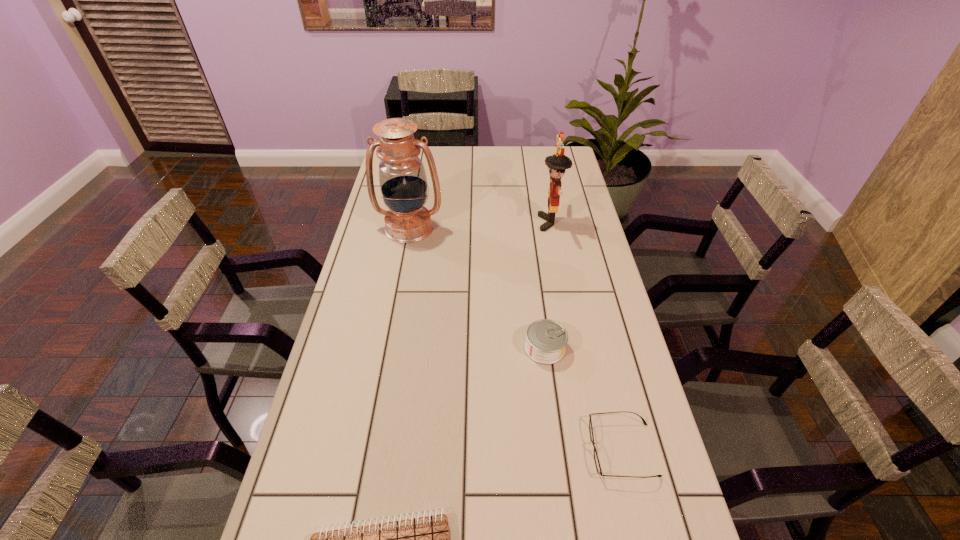
Find the location of a particular element. oil lamp is located at coordinates (403, 182).

Locate an element on the screen. This screenshot has width=960, height=540. nutcracker is located at coordinates (557, 164).

The image size is (960, 540). What are the coordinates of `the third farthest object` in the screenshot? It's located at [x=546, y=339].

This screenshot has width=960, height=540. Identify the location of can. (546, 339).

You are a GUI agent. You are given a task and a screenshot of the screen. Output one action in this format:
    pyautogui.click(x=<x>, y=<y>)
    Task: Click on the spectacles
    This screenshot has height=540, width=960.
    Given the screenshot: What is the action you would take?
    pyautogui.click(x=596, y=459)

Where is `the second shortest object`? the second shortest object is located at coordinates (596, 459).

Identify the location of vacant region located on the right of the oil lamp. (505, 227).

Where is `vacant space located on the front-facing side of the nutcracker`? vacant space located on the front-facing side of the nutcracker is located at coordinates pos(450,222).

This screenshot has width=960, height=540. Find the location of `vacant region located on the front-facing side of the nutcracker`. vacant region located on the front-facing side of the nutcracker is located at coordinates (481, 222).

The height and width of the screenshot is (540, 960). I want to click on vacant space located on the front-facing side of the nutcracker, so click(468, 222).